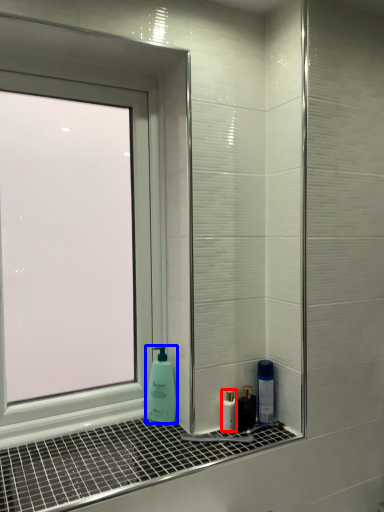
Question: Among these objects, which one is nearest to the camera, mouthwash (highlighted by a red box) or soap dispenser (highlighted by a blue box)?

Choices:
 (A) mouthwash
 (B) soap dispenser

Answer: (A)